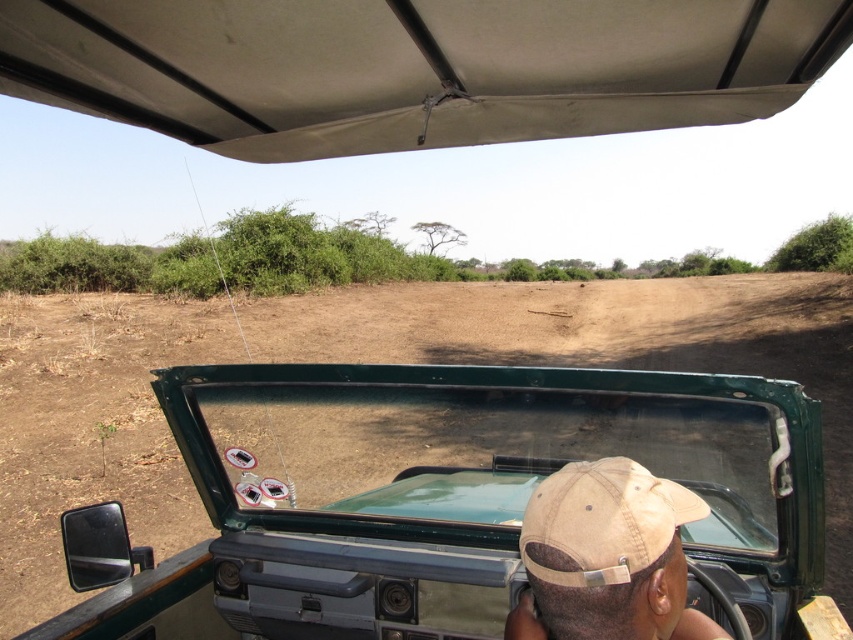
You are a passenger in the safari vehicle and want to see the giraffe outside. The green matte vehicle at center and the tan fabric baseball cap at center are both in your line of sight. Which object is closer to you?

The green matte vehicle at center is closer to you because it has a lesser height compared to the tan fabric baseball cap at center, meaning it is nearer in the line of sight.

You are a passenger in the safari vehicle and want to point out an animal to your friend. The green matte vehicle at center and the beige fabric canopy at upper center are in your line of sight. Which object should you look past to see the animal outside the vehicle?

You should look past the green matte vehicle at center because it is positioned to the right of the beige fabric canopy at upper center, meaning it is blocking the view further to the right.